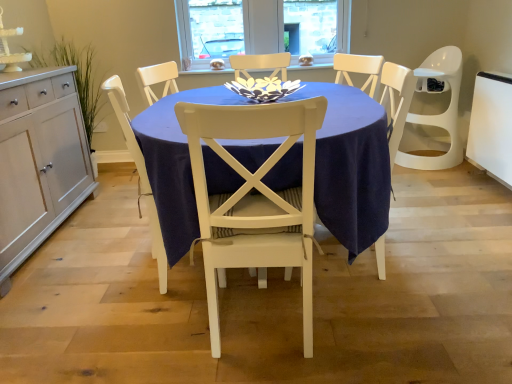
Question: Visually, is white painted wood chair at center, the first chair positioned from the right, positioned to the left or to the right of navy blue fabric table at center?

Choices:
 (A) left
 (B) right

Answer: (A)

Question: Is white painted wood chair at center, which is counted as the 2th chair, starting from the left, spatially inside navy blue fabric table at center, or outside of it?

Choices:
 (A) outside
 (B) inside

Answer: (B)

Question: Which object is positioned closest to the navy blue fabric table at center?

Choices:
 (A) white wood cabinet at left
 (B) white painted wood chair at center, which is counted as the 2th chair, starting from the left
 (C) white wood chair at center, positioned as the second chair in right-to-left order

Answer: (B)

Question: Considering the real-world distances, which object is farthest from the white painted wood chair at center, the first chair positioned from the right?

Choices:
 (A) white wood chair at center, positioned as the second chair in right-to-left order
 (B) white wood cabinet at left
 (C) navy blue fabric table at center

Answer: (B)